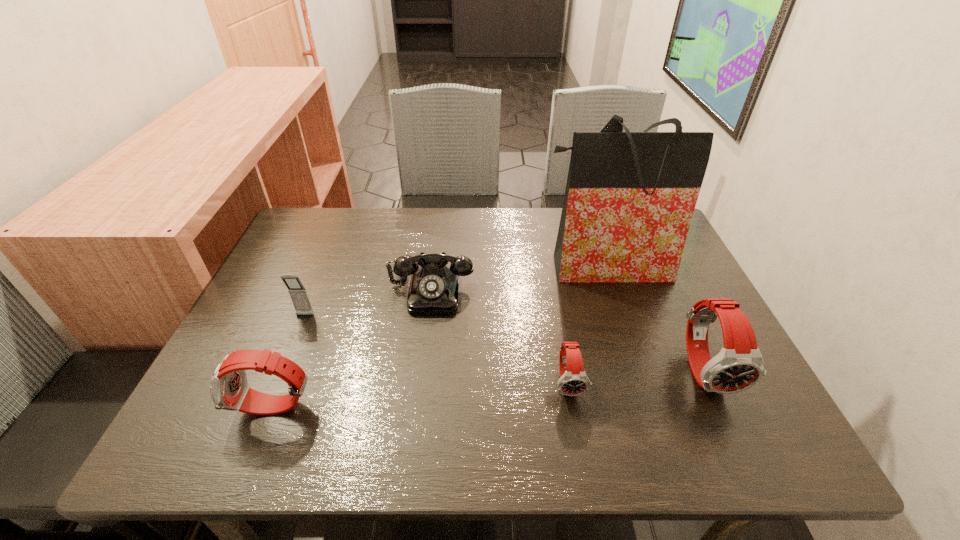
Image resolution: width=960 pixels, height=540 pixels. Find the location of `the second shortest watch`. the second shortest watch is located at coordinates tap(229, 389).

At what (x,y) coordinates should I click in order to perform the action: click on the second watch from right to left. Please return your answer as a coordinate pair (x, y). This screenshot has width=960, height=540. Looking at the image, I should click on (573, 381).

This screenshot has height=540, width=960. I want to click on the rightmost watch, so click(x=739, y=365).

You are a GUI agent. You are given a task and a screenshot of the screen. Output one action in this format:
    pyautogui.click(x=<x>, y=<y>)
    Task: Click on the cellular telephone
    The image size is (960, 540).
    Given the screenshot: What is the action you would take?
    pyautogui.click(x=298, y=293)

You are a GUI agent. You are given a task and a screenshot of the screen. Output one action in this format:
    pyautogui.click(x=<x>, y=<y>)
    Task: Click on the telephone
    This screenshot has height=540, width=960.
    Given the screenshot: What is the action you would take?
    pyautogui.click(x=434, y=288)

Where is `shopping bag`? The height and width of the screenshot is (540, 960). shopping bag is located at coordinates (630, 196).

At what (x,y) coordinates should I click in order to perform the action: click on vacant area situated on the face of the leftmost watch. Please return your answer as a coordinate pair (x, y). Looking at the image, I should click on (210, 408).

I want to click on vacant point located 0.050m on the face of the leftmost watch, so click(210, 408).

The width and height of the screenshot is (960, 540). Identify the location of vacant space located on the front-facing side of the cellular telephone. (265, 411).

The width and height of the screenshot is (960, 540). Identify the location of vacant space located on the dial of the fourth object from right to left. (419, 394).